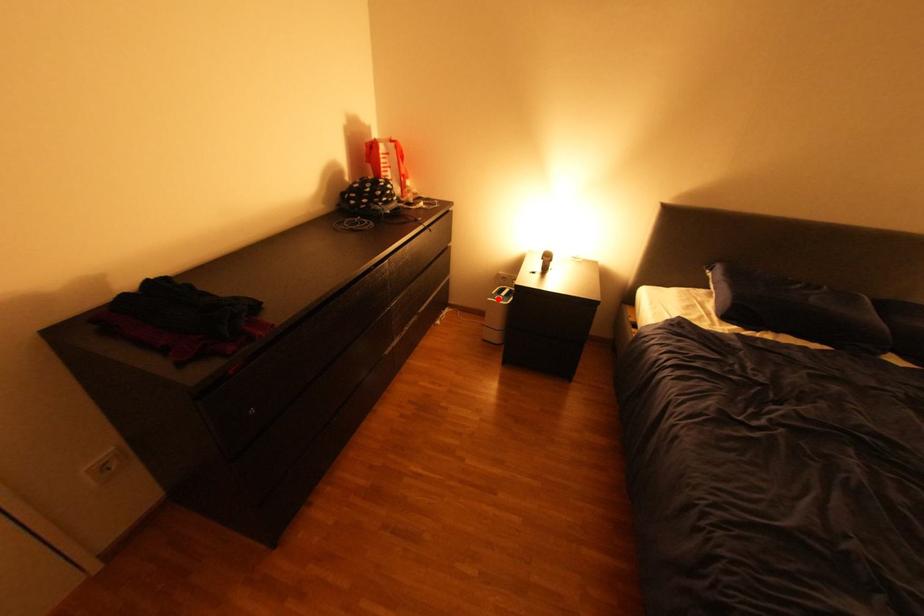
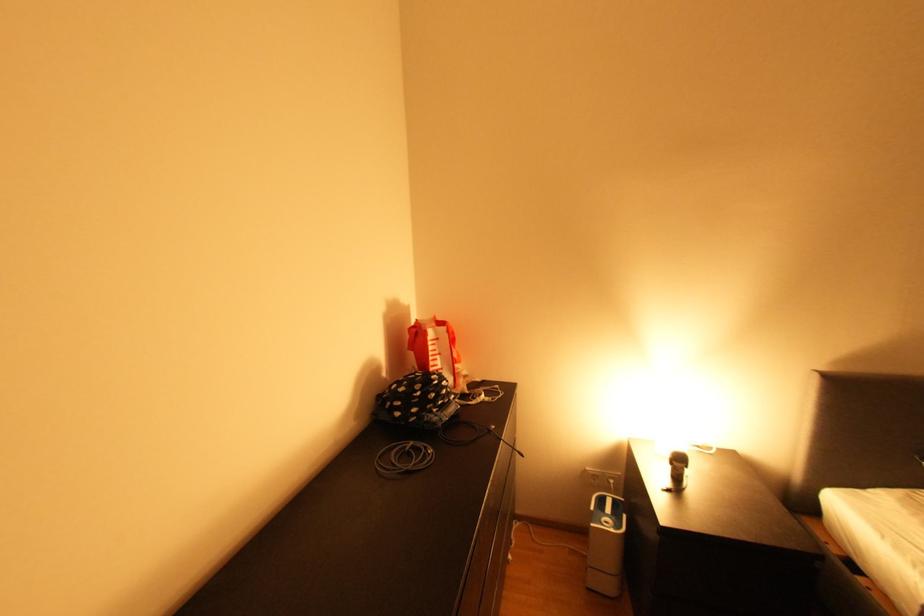
The point at the highlighted location is marked in the first image. Where is the corresponding point in the second image?

(602, 525)